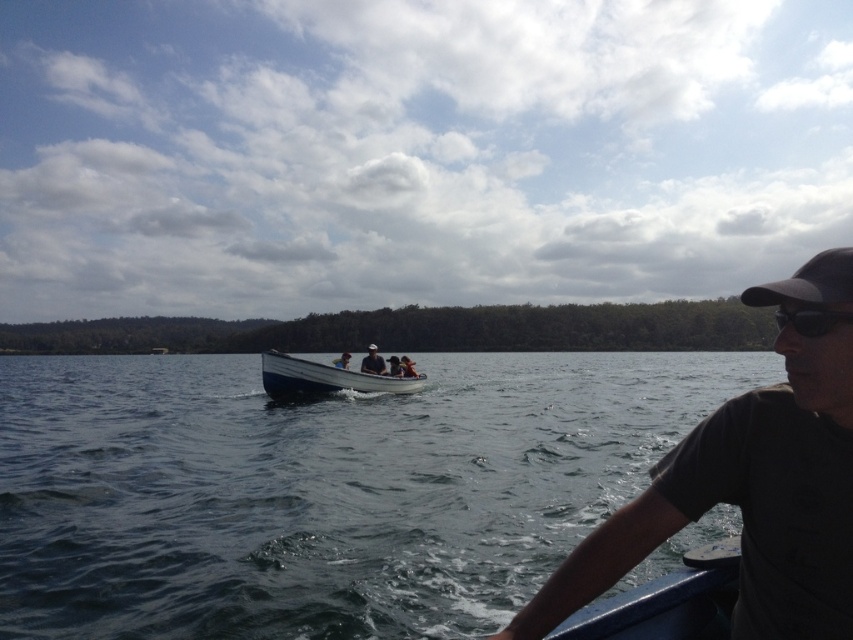
Is black plastic goggles at right thinner than matte black shirt at center?

Yes.

Who is higher up, black plastic goggles at right or matte black shirt at center?

black plastic goggles at right is higher up.

Is point (805, 308) less distant than point (364, 365)?

That is True.

The image size is (853, 640). What are the coordinates of `black plastic goggles at right` in the screenshot? It's located at (811, 320).

Can you confirm if white wood boat at center is smaller than black plastic goggles at right?

Incorrect, white wood boat at center is not smaller in size than black plastic goggles at right.

Is point (341, 371) farther from camera compared to point (822, 328)?

Yes, it is behind point (822, 328).

Where is `white wood boat at center`? white wood boat at center is located at coordinates (325, 378).

Can you confirm if dark gray t-shirt at right is bigger than matte black shirt at center?

Indeed, dark gray t-shirt at right has a larger size compared to matte black shirt at center.

Does dark gray t-shirt at right appear on the right side of matte black shirt at center?

Correct, you'll find dark gray t-shirt at right to the right of matte black shirt at center.

Who is more distant from viewer, (x=849, y=257) or (x=364, y=369)?

Point (x=364, y=369)

In order to click on dark gray t-shirt at right in this screenshot , I will do `click(746, 504)`.